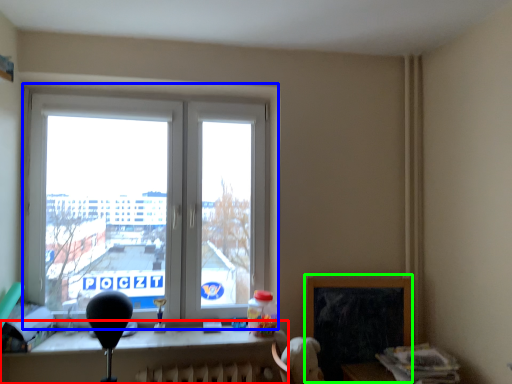
Question: Which object is the farthest from table (highlighted by a red box)? Choose among these: window (highlighted by a blue box) or window screen (highlighted by a green box).

Choices:
 (A) window
 (B) window screen

Answer: (A)